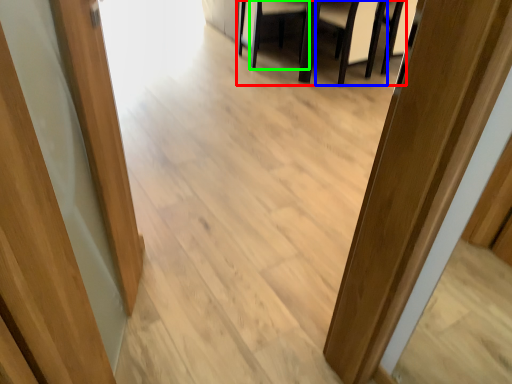
Question: Based on their relative distances, which object is nearer to furniture (highlighted by a red box)? Choose from armchair (highlighted by a blue box) and armchair (highlighted by a green box).

Choices:
 (A) armchair
 (B) armchair

Answer: (A)